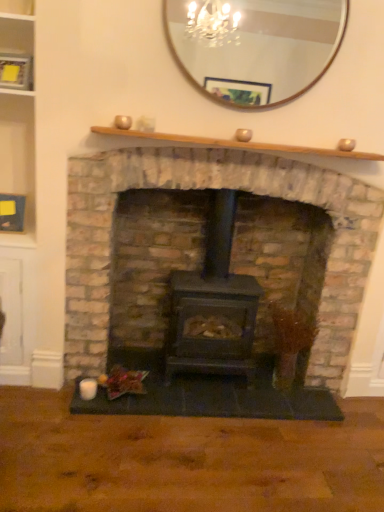
Identify the location of free point above wooden shelf at upper center (from a real-world perspective). 230,140.